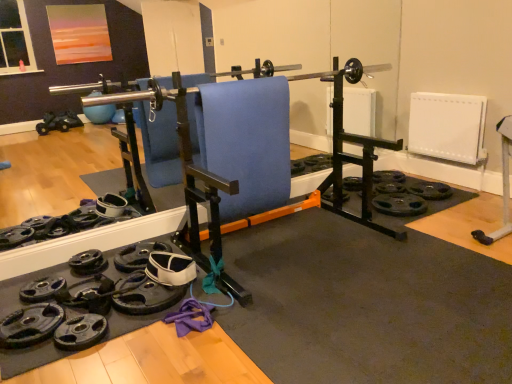
Question: Is black rubber weight plate at lower left, which is counted as the second wheel, starting from the right, shorter than blue fabric swivel chair at center?

Choices:
 (A) yes
 (B) no

Answer: (A)

Question: Is black rubber weight plate at lower left, the second wheel viewed from the left, aimed at blue fabric swivel chair at center?

Choices:
 (A) no
 (B) yes

Answer: (A)

Question: Is black rubber weight plate at lower left, arranged as the second wheel when ordered from the bottom, to the right of blue fabric swivel chair at center from the viewer's perspective?

Choices:
 (A) yes
 (B) no

Answer: (B)

Question: Is black rubber weight plate at lower left, which is counted as the second wheel, starting from the right, with blue fabric swivel chair at center?

Choices:
 (A) no
 (B) yes

Answer: (A)

Question: Is black rubber weight plate at lower left, the second wheel when ordered from top to bottom, wider than blue fabric swivel chair at center?

Choices:
 (A) no
 (B) yes

Answer: (B)

Question: Considering the relative sizes of black rubber weight plate at lower left, arranged as the second wheel when ordered from the bottom, and blue fabric swivel chair at center in the image provided, is black rubber weight plate at lower left, arranged as the second wheel when ordered from the bottom, smaller than blue fabric swivel chair at center?

Choices:
 (A) no
 (B) yes

Answer: (B)

Question: From a real-world perspective, does blue fabric swivel chair at center stand above black rubber weight plate at center, acting as the first wheel starting from the right?

Choices:
 (A) no
 (B) yes

Answer: (B)

Question: Does blue fabric swivel chair at center have a smaller size compared to black rubber weight plate at center, acting as the first wheel starting from the right?

Choices:
 (A) yes
 (B) no

Answer: (B)

Question: From the image's perspective, is blue fabric swivel chair at center over black rubber weight plate at center, acting as the first wheel starting from the right?

Choices:
 (A) yes
 (B) no

Answer: (A)

Question: Is black rubber weight plate at center, the 1th wheel viewed from the back, completely or partially inside blue fabric swivel chair at center?

Choices:
 (A) yes
 (B) no

Answer: (B)

Question: Is black rubber weight plate at center, the first wheel positioned from the top, at the back of blue fabric swivel chair at center?

Choices:
 (A) yes
 (B) no

Answer: (B)

Question: Does blue fabric swivel chair at center lie behind black rubber weight plate at center, acting as the 3th wheel starting from the bottom?

Choices:
 (A) yes
 (B) no

Answer: (B)

Question: From a real-world perspective, is black rubber weight plate at lower left, the third wheel positioned from the right, located beneath black rubber weight plate at lower left, which is the second wheel from front to back?

Choices:
 (A) yes
 (B) no

Answer: (A)